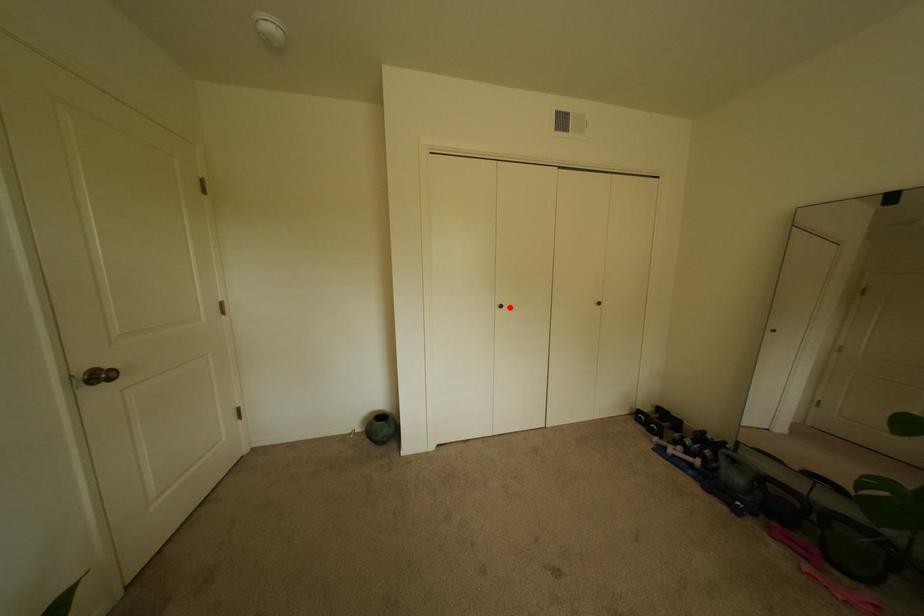
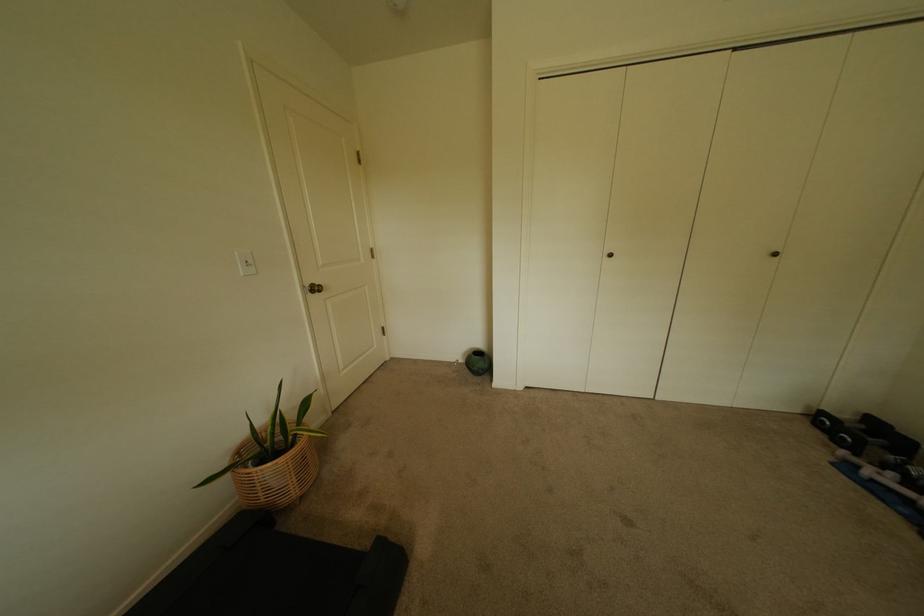
In the second image, find the point that corresponds to the highlighted location in the first image.

(618, 256)